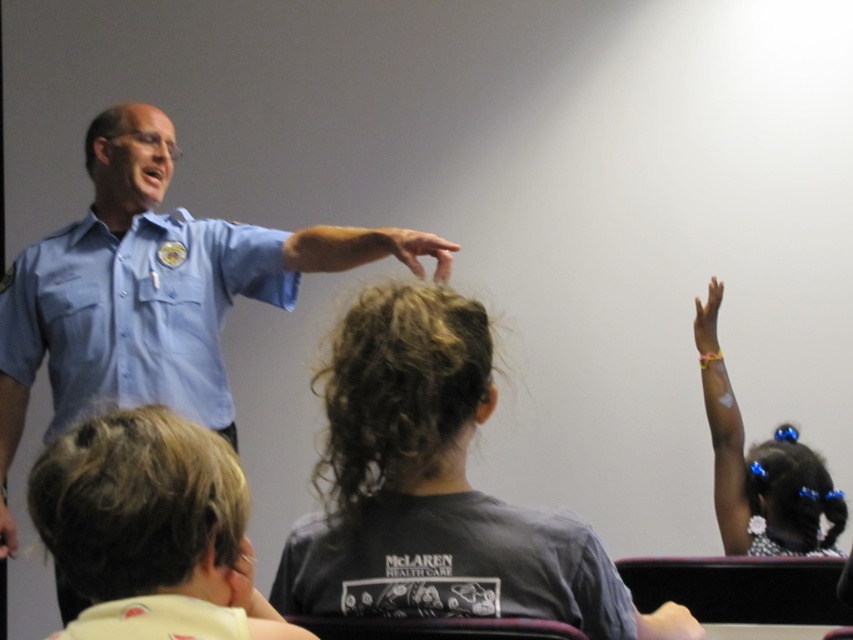
Question: Where is blue uniform shirt at upper left located in relation to yellow rubber glove at upper right in the image?

Choices:
 (A) above
 (B) below

Answer: (B)

Question: From the image, what is the correct spatial relationship of dark gray t-shirt at center in relation to matte blue shirt at center?

Choices:
 (A) right
 (B) left

Answer: (A)

Question: Is blue uniform shirt at upper left thinner than blonde hair at lower left?

Choices:
 (A) no
 (B) yes

Answer: (A)

Question: Among these points, which one is nearest to the camera?

Choices:
 (A) (415, 232)
 (B) (724, 465)
 (C) (286, 262)

Answer: (A)

Question: Based on their relative distances, which object is nearer to the yellow rubber glove at upper right?

Choices:
 (A) dark gray t-shirt at center
 (B) blue uniform shirt at upper left
 (C) matte blue shirt at center
 (D) light blue uniform at left

Answer: (C)

Question: Which point is farther to the camera?

Choices:
 (A) matte blue shirt at center
 (B) dark gray t-shirt at center
 (C) blonde hair at lower left
 (D) light blue uniform at left

Answer: (D)